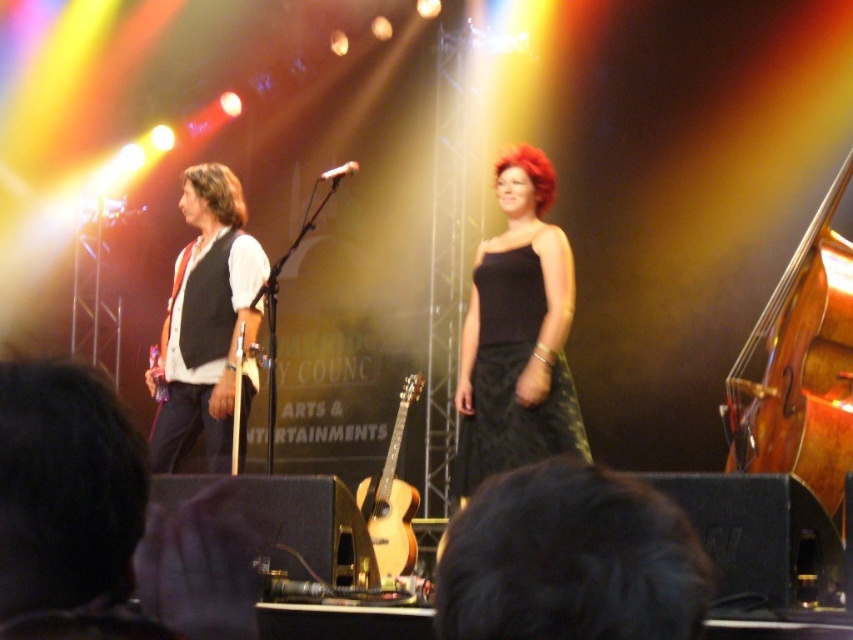
Does wooden acoustic guitar at left appear on the right side of red shiny hair at center?

Incorrect, wooden acoustic guitar at left is not on the right side of red shiny hair at center.

Describe the element at coordinates (245, 362) in the screenshot. I see `wooden acoustic guitar at left` at that location.

Is point (250, 346) less distant than point (525, 148)?

Yes, point (250, 346) is in front of point (525, 148).

Find the location of a particular element. The width and height of the screenshot is (853, 640). wooden acoustic guitar at left is located at coordinates [245, 362].

Who is positioned more to the left, black satin dress at center or silver metallic microphone at center?

silver metallic microphone at center is more to the left.

Does black satin dress at center have a larger size compared to silver metallic microphone at center?

Indeed, black satin dress at center has a larger size compared to silver metallic microphone at center.

Measure the distance between black satin dress at center and camera.

13.32 feet

Locate an element on the screen. black satin dress at center is located at coordinates (517, 336).

Does black satin dress at center have a greater width compared to matte black vest at left?

No, black satin dress at center is not wider than matte black vest at left.

Is black satin dress at center shorter than matte black vest at left?

Incorrect, black satin dress at center's height does not fall short of matte black vest at left's.

Which is in front, point (456, 470) or point (235, 269)?

Point (456, 470) is in front.

The height and width of the screenshot is (640, 853). Find the location of `black satin dress at center`. black satin dress at center is located at coordinates (517, 336).